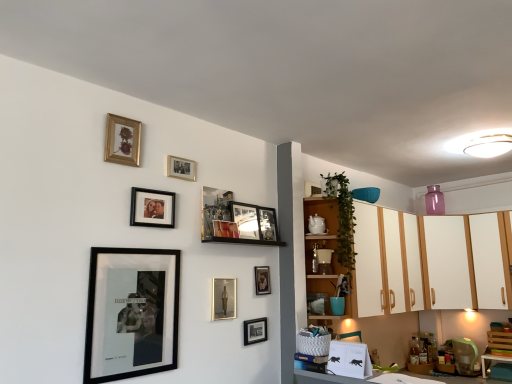
You are a GUI agent. You are given a task and a screenshot of the screen. Output one action in this format:
    pyautogui.click(x=<x>, y=<y>)
    Task: Click on the metallic silver photo frame at upper center, which is counted as the 6th picture frame, starting from the bottom
    
    Given the screenshot: What is the action you would take?
    pyautogui.click(x=268, y=224)

Locate an element on the screen. Image resolution: width=512 pixels, height=384 pixels. metallic silver photo frame at upper center, which ranks as the eighth picture frame in top-to-bottom order is located at coordinates (262, 280).

I want to click on wooden cabinet at upper right, so click(x=321, y=248).

Measure the distance between wooden cabinet at upper right and camera.

wooden cabinet at upper right and camera are 2.52 meters apart from each other.

This screenshot has height=384, width=512. Describe the element at coordinates (214, 209) in the screenshot. I see `metallic silver photo frame at upper center, positioned as the 4th picture frame in top-to-bottom order` at that location.

The width and height of the screenshot is (512, 384). What are the coordinates of `metallic silver photo frame at upper center, which is counted as the 6th picture frame, starting from the bottom` in the screenshot? It's located at (268, 224).

Does white glossy cabinet at right have a lesser height compared to white matte cabinet at upper right, the third cabinetry positioned from the left?

Indeed, white glossy cabinet at right has a lesser height compared to white matte cabinet at upper right, the third cabinetry positioned from the left.

In the image, is white glossy cabinet at right on the left side or the right side of white matte cabinet at upper right, the third cabinetry positioned from the left?

white glossy cabinet at right is positioned on white matte cabinet at upper right, the third cabinetry positioned from the left,'s left side.

Is white matte cabinet at upper right, which ranks as the first cabinetry in right-to-left order, completely or partially inside white glossy cabinet at right?

Yes, white matte cabinet at upper right, which ranks as the first cabinetry in right-to-left order, is a part of white glossy cabinet at right.

From the image's perspective, which one is positioned higher, white glossy cabinet at right or white matte cabinet at upper right, which ranks as the first cabinetry in right-to-left order?

white glossy cabinet at right, from the image's perspective.

Is matte black picture frame at upper center, acting as the 5th picture frame starting from the top, closer to camera compared to gold-framed photo at upper center, the tenth picture frame ordered from the bottom?

No, matte black picture frame at upper center, acting as the 5th picture frame starting from the top, is further to the viewer.

The height and width of the screenshot is (384, 512). In order to click on picture frame that is the 3rd one when counting upward from the matte black picture frame at upper center, arranged as the 7th picture frame when ordered from the bottom (from the image's perspective) in this screenshot , I will do `click(181, 168)`.

Is matte black picture frame at upper center, acting as the 5th picture frame starting from the top, inside or outside of gold-framed photo at upper center, which is the 2th picture frame from top to bottom?

The correct answer is: outside.

From the picture: Does matte black picture frame at upper center, acting as the 5th picture frame starting from the top, have a smaller size compared to gold-framed photo at upper center, which is the 2th picture frame from top to bottom?

Actually, matte black picture frame at upper center, acting as the 5th picture frame starting from the top, might be larger than gold-framed photo at upper center, which is the 2th picture frame from top to bottom.

Could you tell me if metallic silver photo frame at upper center, positioned as the 4th picture frame in top-to-bottom order, is turned towards black matte picture frame at upper center, which ranks as the ninth picture frame in bottom-to-top order?

No, metallic silver photo frame at upper center, positioned as the 4th picture frame in top-to-bottom order, is not facing towards black matte picture frame at upper center, which ranks as the ninth picture frame in bottom-to-top order.

Are metallic silver photo frame at upper center, the eighth picture frame from the bottom, and black matte picture frame at upper center, which is counted as the 3th picture frame, starting from the top, located far from each other?

No, metallic silver photo frame at upper center, the eighth picture frame from the bottom, is not far from black matte picture frame at upper center, which is counted as the 3th picture frame, starting from the top.

From the picture: Can you confirm if metallic silver photo frame at upper center, positioned as the 4th picture frame in top-to-bottom order, is thinner than black matte picture frame at upper center, which is counted as the 3th picture frame, starting from the top?

Correct, the width of metallic silver photo frame at upper center, positioned as the 4th picture frame in top-to-bottom order, is less than that of black matte picture frame at upper center, which is counted as the 3th picture frame, starting from the top.

Considering their positions, is black matte picture frame at lower left, positioned as the 3th picture frame in bottom-to-top order, located in front of or behind metallic silver portrait at center, marked as the tenth picture frame in a top-to-bottom arrangement?

Clearly, black matte picture frame at lower left, positioned as the 3th picture frame in bottom-to-top order, is in front of metallic silver portrait at center, marked as the tenth picture frame in a top-to-bottom arrangement.

Does point (162, 328) come behind point (232, 310)?

No, (162, 328) is in front of (232, 310).

Is black matte picture frame at lower left, placed as the 9th picture frame when sorted from top to bottom, looking in the opposite direction of metallic silver portrait at center, marked as the tenth picture frame in a top-to-bottom arrangement?

black matte picture frame at lower left, placed as the 9th picture frame when sorted from top to bottom, does not have its back to metallic silver portrait at center, marked as the tenth picture frame in a top-to-bottom arrangement.

Looking at this image, between black matte picture frame at upper center, which ranks as the ninth picture frame in bottom-to-top order, and metallic silver photo frame at upper center, arranged as the fourth picture frame when ordered from the bottom, which one has smaller width?

With smaller width is black matte picture frame at upper center, which ranks as the ninth picture frame in bottom-to-top order.

Does point (137, 217) come farther from viewer compared to point (258, 281)?

That is False.

Considering the sizes of objects black matte picture frame at upper center, which is counted as the 3th picture frame, starting from the top, and metallic silver photo frame at upper center, which ranks as the eighth picture frame in top-to-bottom order, in the image provided, who is bigger, black matte picture frame at upper center, which is counted as the 3th picture frame, starting from the top, or metallic silver photo frame at upper center, which ranks as the eighth picture frame in top-to-bottom order,?

Bigger between the two is black matte picture frame at upper center, which is counted as the 3th picture frame, starting from the top.

Is metallic silver photo frame at upper center, which is counted as the 6th picture frame, starting from the bottom, not close to gold metallic picture frame at upper left, the first picture frame viewed from the top?

No, metallic silver photo frame at upper center, which is counted as the 6th picture frame, starting from the bottom, is not far away from gold metallic picture frame at upper left, the first picture frame viewed from the top.

Considering the sizes of objects metallic silver photo frame at upper center, which is counted as the 6th picture frame, starting from the bottom, and gold metallic picture frame at upper left, which is the 11th picture frame from bottom to top, in the image provided, who is shorter, metallic silver photo frame at upper center, which is counted as the 6th picture frame, starting from the bottom, or gold metallic picture frame at upper left, which is the 11th picture frame from bottom to top,?

gold metallic picture frame at upper left, which is the 11th picture frame from bottom to top.

Which of these two, metallic silver photo frame at upper center, which is counted as the 6th picture frame, starting from the bottom, or gold metallic picture frame at upper left, the first picture frame viewed from the top, is wider?

metallic silver photo frame at upper center, which is counted as the 6th picture frame, starting from the bottom.

Is black matte picture frame at upper center, which is counted as the 3th picture frame, starting from the top, placed right next to white glossy cabinet at right?

black matte picture frame at upper center, which is counted as the 3th picture frame, starting from the top, is not next to white glossy cabinet at right, and they're not touching.

Is black matte picture frame at upper center, which ranks as the ninth picture frame in bottom-to-top order, bigger than white glossy cabinet at right?

No.

Which of these two, black matte picture frame at upper center, which is counted as the 3th picture frame, starting from the top, or white glossy cabinet at right, stands taller?

With more height is white glossy cabinet at right.

The height and width of the screenshot is (384, 512). In order to click on shelf to the left of white matte cabinet at upper right, the third cabinetry positioned from the left in this screenshot , I will do `click(426, 263)`.

You are a GUI agent. You are given a task and a screenshot of the screen. Output one action in this format:
    pyautogui.click(x=<x>, y=<y>)
    Task: Click on the 3rd picture frame positioned above the matte black picture frame at upper center, acting as the 5th picture frame starting from the top (from a real-world perspective)
    The height and width of the screenshot is (384, 512).
    Given the screenshot: What is the action you would take?
    pyautogui.click(x=181, y=168)

When comparing their distances from matte black picture frame at upper center, arranged as the 7th picture frame when ordered from the bottom, does metallic silver photo frame at upper center, which ranks as the eighth picture frame in top-to-bottom order, or wooden cabinet at upper right seem closer?

metallic silver photo frame at upper center, which ranks as the eighth picture frame in top-to-bottom order, lies closer to matte black picture frame at upper center, arranged as the 7th picture frame when ordered from the bottom, than the other object.

From the image, which object appears to be farther from black matte picture frame at lower center, the eleventh picture frame from the top, black matte picture frame at upper center, which is counted as the 3th picture frame, starting from the top, or metallic silver photo frame at upper center, the eighth picture frame from the bottom?

black matte picture frame at upper center, which is counted as the 3th picture frame, starting from the top, is further to black matte picture frame at lower center, the eleventh picture frame from the top.

Looking at the image, which one is located closer to white glossy cabinet at right, metallic silver photo frame at upper center, positioned as the 4th picture frame in top-to-bottom order, or metallic silver picture frame at upper center, which appears as the 7th picture frame when viewed from the top?

Among the two, metallic silver photo frame at upper center, positioned as the 4th picture frame in top-to-bottom order, is located nearer to white glossy cabinet at right.

Considering their positions, is white matte cabinet at upper right, which ranks as the 1th cabinetry in left-to-right order, positioned further to matte black picture frame at upper center, arranged as the 7th picture frame when ordered from the bottom, than metallic silver photo frame at upper center, which is counted as the 6th picture frame, starting from the bottom?

white matte cabinet at upper right, which ranks as the 1th cabinetry in left-to-right order, is further to matte black picture frame at upper center, arranged as the 7th picture frame when ordered from the bottom.

When comparing their distances from metallic silver photo frame at upper center, placed as the 6th picture frame when sorted from top to bottom, does black matte picture frame at upper center, which is counted as the 3th picture frame, starting from the top, or metallic silver picture frame at upper center, the 5th picture frame positioned from the bottom, seem closer?

metallic silver picture frame at upper center, the 5th picture frame positioned from the bottom, lies closer to metallic silver photo frame at upper center, placed as the 6th picture frame when sorted from top to bottom, than the other object.

Based on their spatial positions, is gold metallic picture frame at upper left, the first picture frame viewed from the top, or wooden cabinet at upper right further from black matte picture frame at lower center, the 1th picture frame ordered from the bottom?

gold metallic picture frame at upper left, the first picture frame viewed from the top, is further to black matte picture frame at lower center, the 1th picture frame ordered from the bottom.

Based on the photo, from the image, which object appears to be farther from metallic silver photo frame at upper center, the eighth picture frame from the bottom, black matte picture frame at lower center, the eleventh picture frame from the top, or metallic silver picture frame at upper center, which appears as the 7th picture frame when viewed from the top?

Among the two, black matte picture frame at lower center, the eleventh picture frame from the top, is located further to metallic silver photo frame at upper center, the eighth picture frame from the bottom.

Based on their spatial positions, is metallic silver picture frame at upper center, which appears as the 7th picture frame when viewed from the top, or metallic silver photo frame at upper center, positioned as the 4th picture frame in top-to-bottom order, further from gold metallic picture frame at upper left, the first picture frame viewed from the top?

Among the two, metallic silver picture frame at upper center, which appears as the 7th picture frame when viewed from the top, is located further to gold metallic picture frame at upper left, the first picture frame viewed from the top.

The height and width of the screenshot is (384, 512). I want to click on shelf situated between gold-framed photo at upper center, the tenth picture frame ordered from the bottom, and white matte cabinet at upper right, which ranks as the first cabinetry in right-to-left order, from left to right, so click(426, 263).

At what (x,y) coordinates should I click in order to perform the action: click on cabinet between metallic silver photo frame at upper center, which is counted as the 6th picture frame, starting from the bottom, and white matte cabinet at upper right, which ranks as the first cabinetry in right-to-left order, from left to right. Please return your answer as a coordinate pair (x, y). The height and width of the screenshot is (384, 512). Looking at the image, I should click on (321, 248).

Where is `plant situated between black matte picture frame at upper center, which is counted as the 3th picture frame, starting from the top, and white matte cabinet at upper right, the third cabinetry positioned from the left, from left to right`? plant situated between black matte picture frame at upper center, which is counted as the 3th picture frame, starting from the top, and white matte cabinet at upper right, the third cabinetry positioned from the left, from left to right is located at coordinates (342, 219).

Locate an element on the screen. Image resolution: width=512 pixels, height=384 pixels. plant situated between wooden cabinet at upper right and white matte cabinet at upper right, the third cabinetry positioned from the left, from left to right is located at coordinates (342, 219).